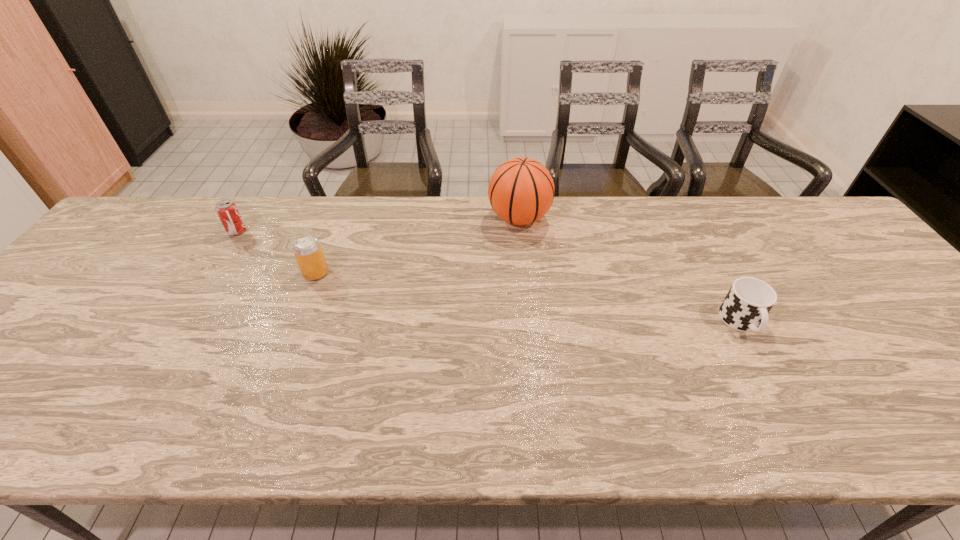
Where is `the tallest object`? The image size is (960, 540). the tallest object is located at coordinates (521, 191).

At what (x,y) coordinates should I click in order to perform the action: click on basketball. Please return your answer as a coordinate pair (x, y). The width and height of the screenshot is (960, 540). Looking at the image, I should click on (521, 191).

The width and height of the screenshot is (960, 540). I want to click on the nearer soda can, so click(x=308, y=252).

Locate an element on the screen. the third farthest object is located at coordinates (308, 252).

You are a GUI agent. You are given a task and a screenshot of the screen. Output one action in this format:
    pyautogui.click(x=<x>, y=<y>)
    Task: Click on the farther soda can
    
    Given the screenshot: What is the action you would take?
    pyautogui.click(x=226, y=209)

This screenshot has height=540, width=960. Find the location of `the left soda can`. the left soda can is located at coordinates (226, 209).

You are a GUI agent. You are given a task and a screenshot of the screen. Output one action in this format:
    pyautogui.click(x=<x>, y=<y>)
    Task: Click on the rightmost object
    The image size is (960, 540).
    Given the screenshot: What is the action you would take?
    pyautogui.click(x=746, y=306)

Identify the location of cup. The image size is (960, 540). (746, 306).

The width and height of the screenshot is (960, 540). Find the location of `free location located 0.160m on the front of the third object from left to right`. free location located 0.160m on the front of the third object from left to right is located at coordinates (525, 278).

The height and width of the screenshot is (540, 960). I want to click on free space located 0.210m on the back of the second object from left to right, so click(337, 217).